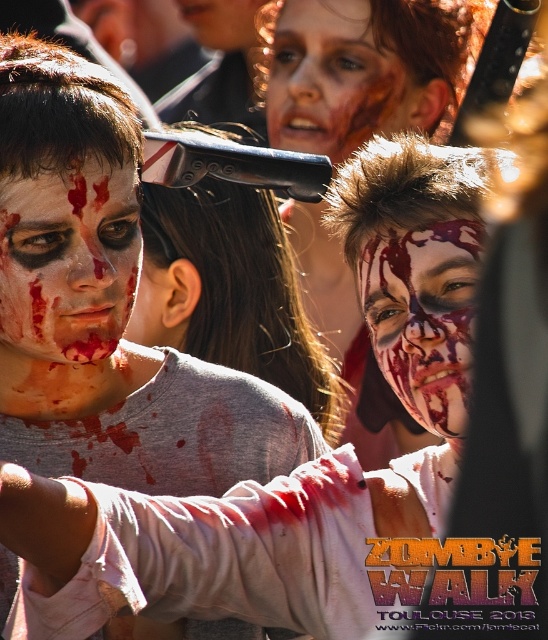
You are a photographer standing at the back of the crowd at the Zombie Walk event. You want to take a closeup photo of the matte white face at left. Your camera has a minimum focusing distance of 3 meters. Can you take the photo without moving closer?

The matte white face at left and the viewer are 5.79 meters apart. Since your camera can focus as close as 3 meters, you can take the photo without moving closer because the distance is within the camera s focusing range.

You are standing at the center of the image and want to find the matte white face at left. In which direction should you turn your head to locate it?

The matte white face at left is located at point (68,260), which is to the left side of the image. Therefore, you should turn your head to the left to locate it.